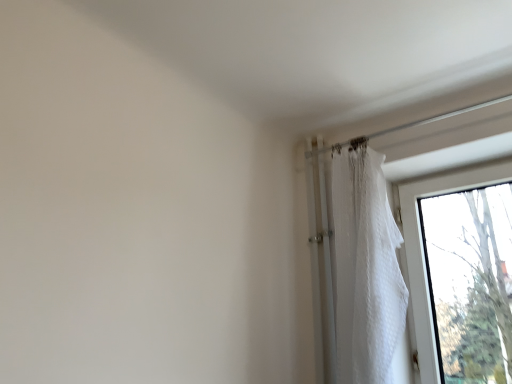
Question: In terms of width, does transparent glass window at right look wider or thinner when compared to white textured curtain at right?

Choices:
 (A) wide
 (B) thin

Answer: (B)

Question: Does point (421, 324) appear closer or farther from the camera than point (372, 279)?

Choices:
 (A) farther
 (B) closer

Answer: (A)

Question: In the image, is transparent glass window at right positioned in front of or behind white textured curtain at right?

Choices:
 (A) behind
 (B) front

Answer: (A)

Question: In terms of width, does white textured curtain at right look wider or thinner when compared to transparent glass window at right?

Choices:
 (A) wide
 (B) thin

Answer: (A)

Question: From a real-world perspective, relative to transparent glass window at right, is white textured curtain at right vertically above or below?

Choices:
 (A) below
 (B) above

Answer: (B)

Question: Based on their positions, is white textured curtain at right located to the left or right of transparent glass window at right?

Choices:
 (A) left
 (B) right

Answer: (A)

Question: Considering the positions of point (385, 349) and point (420, 266), is point (385, 349) closer or farther from the camera than point (420, 266)?

Choices:
 (A) closer
 (B) farther

Answer: (A)